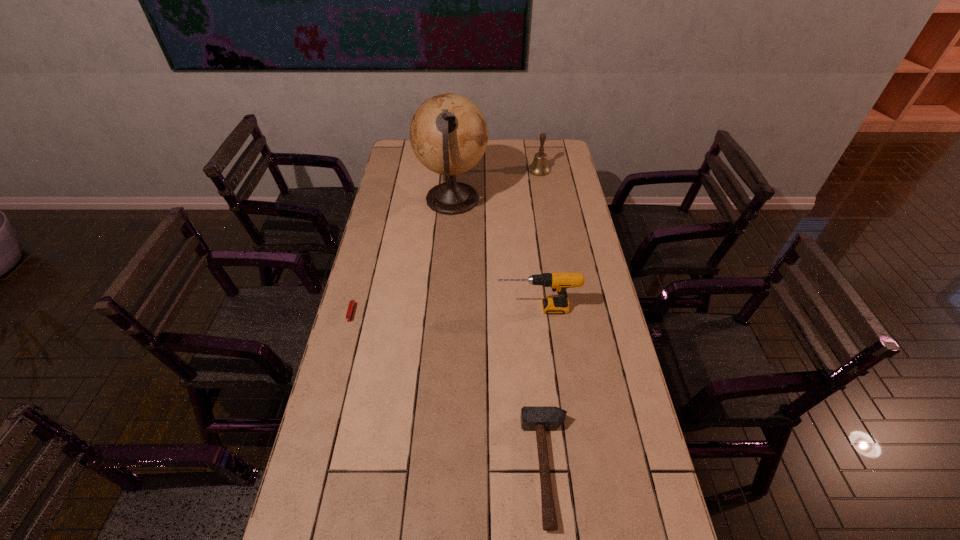
Locate an element on the screen. free location located 0.240m on the handle side of the third shortest object is located at coordinates (427, 308).

Locate an element on the screen. The image size is (960, 540). blank space located on the handle side of the third shortest object is located at coordinates click(x=424, y=308).

The height and width of the screenshot is (540, 960). I want to click on vacant region located 0.300m on the handle side of the third shortest object, so click(x=410, y=308).

The height and width of the screenshot is (540, 960). In order to click on vacant space situated 0.080m on the striking surface of the second shortest object in this screenshot , I will do `click(493, 468)`.

I want to click on vacant area situated 0.350m on the striking surface of the second shortest object, so click(391, 468).

This screenshot has width=960, height=540. Identify the location of free space located 0.090m on the striking surface of the second shortest object. (490, 468).

Where is `vacant space situated on the front-facing side of the stapler`? vacant space situated on the front-facing side of the stapler is located at coordinates click(x=341, y=354).

Locate an element on the screen. Image resolution: width=960 pixels, height=540 pixels. object that is at the far edge is located at coordinates (539, 167).

Where is `globe that is at the left edge`? The height and width of the screenshot is (540, 960). globe that is at the left edge is located at coordinates (448, 133).

Locate an element on the screen. This screenshot has width=960, height=540. stapler present at the left edge is located at coordinates (352, 303).